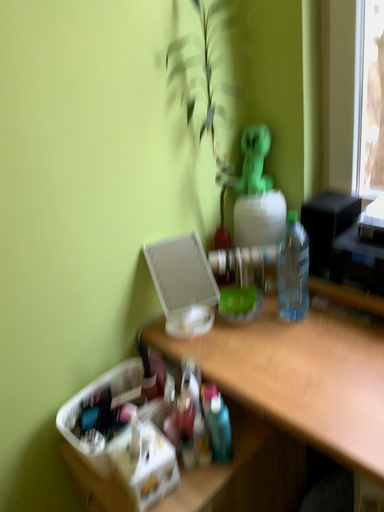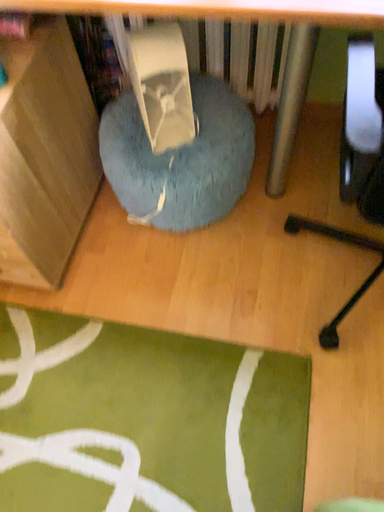
Question: How did the camera likely rotate when shooting the video?

Choices:
 (A) rotated left
 (B) rotated right

Answer: (B)